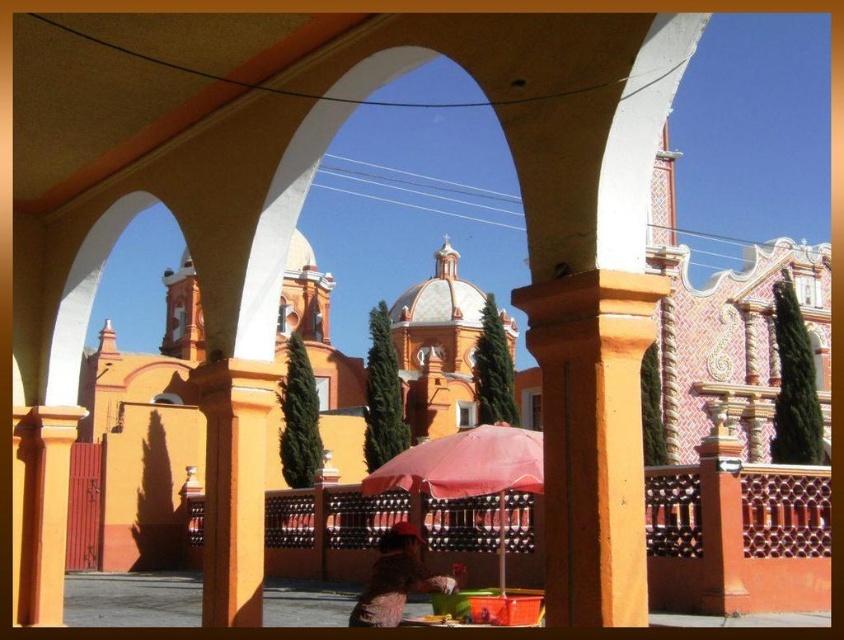
You are standing in the walkway under the arches and want to place a small potted plant between the matte orange column at center and the pink fabric umbrella at lower center. Based on their positions, can you tell me which object you should place the plant closer to in order to keep it centered between them?

The matte orange column at center is positioned over the pink fabric umbrella at lower center, so to keep the plant centered between them, you should place it closer to the pink fabric umbrella at lower center.

You are standing at the entrance of the archway and want to locate the matte orange column at center. According to the coordinate system where the bottom left corner is the origin, which direction should you look to find it?

The matte orange column at center is located at coordinate point (233,484), so you should look towards the upper right direction from your current position at the entrance.